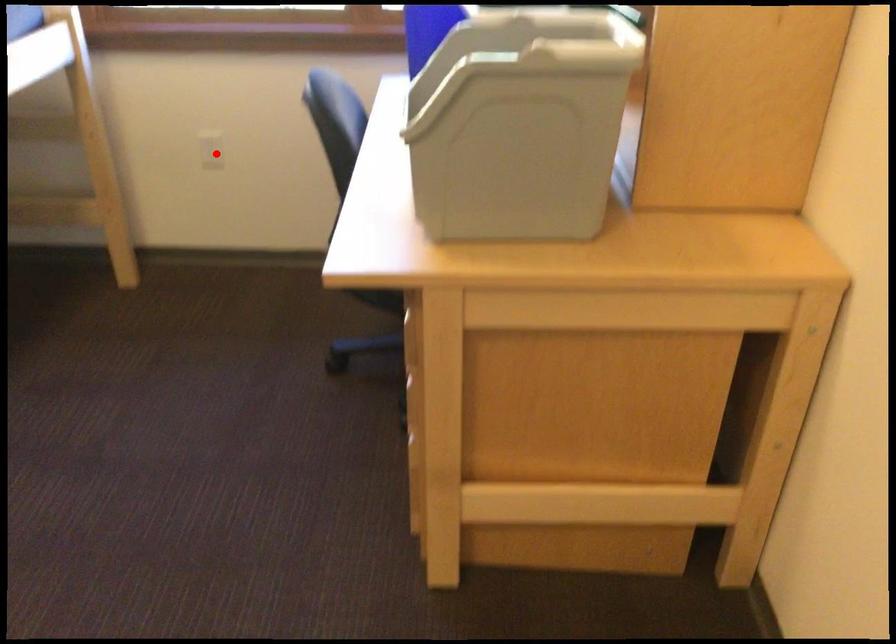
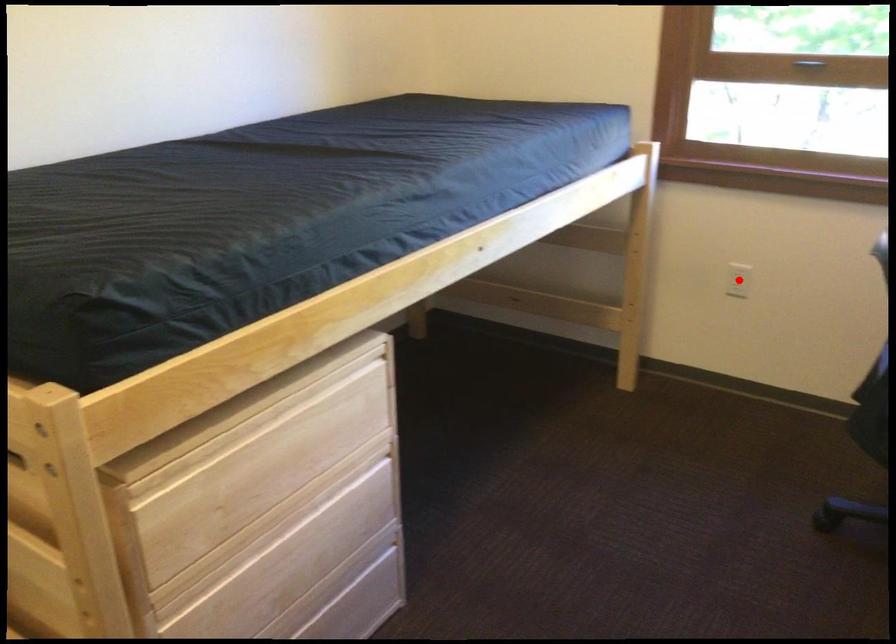
I am providing you with two images of the same scene from different viewpoints. A red point is marked on the first image and another point is marked on the second image. Are the points marked in image1 and image2 representing the same 3D position?

Yes